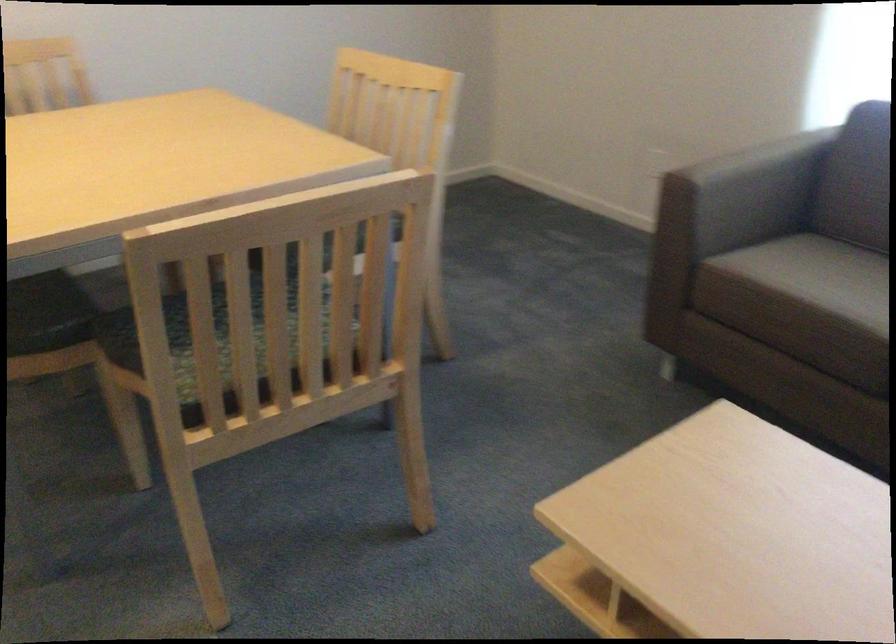
Describe the element at coordinates (47, 313) in the screenshot. I see `the dark sofa sitting surface` at that location.